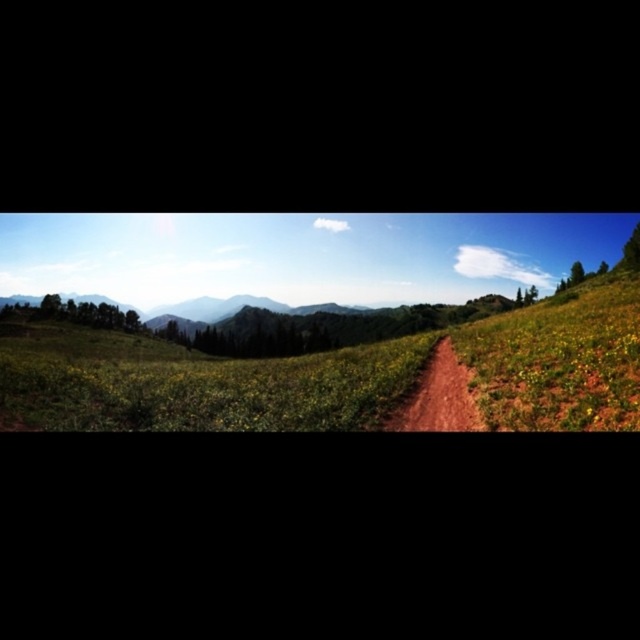
You are planning to set up a tent for a camping trip. You have two options for the location based on the image provided. The first option is on the green grassy field at center, and the second is on the brown dirt track at center. Considering the height difference between these two areas, which location would be more suitable for setting up your tent to avoid water accumulation during rain?

The green grassy field at center is taller than the brown dirt track at center. Therefore, the brown dirt track at center is lower and might collect water during rain, making the green grassy field at center a better choice to avoid water accumulation.

You are a hiker planning to walk along the brown dirt track at center. You want to know if the green grassy field at center is within a 400 feet radius from your path. Can you confirm?

The green grassy field at center is 352.57 feet from the brown dirt track at center, which is within the 400 feet radius, so yes, the green grassy field at center is within the desired distance from the path.

You are planning a picnic and want to set up a blanket. Given the green grassy field at center and the brown dirt track at center, which location would provide a more stable and flat surface for your picnic blanket?

The green grassy field at center has a larger size compared to brown dirt track at center, so it is more likely to have a stable and flat area for the picnic blanket.